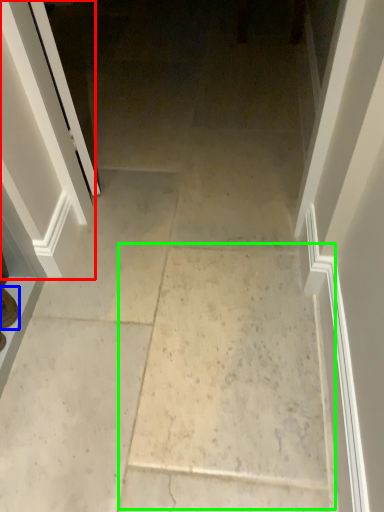
Question: Estimate the real-world distances between objects in this image. Which object is closer to screen door (highlighted by a red box), footwear (highlighted by a blue box) or concrete (highlighted by a green box)?

Choices:
 (A) footwear
 (B) concrete

Answer: (A)